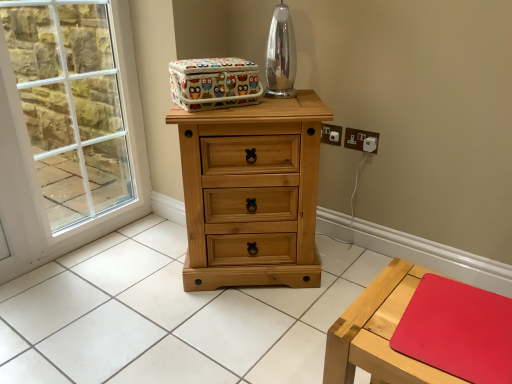
Question: Considering the relative sizes of white plastic electric outlet at upper right and colorful fabric storage box at upper center in the image provided, is white plastic electric outlet at upper right smaller than colorful fabric storage box at upper center?

Choices:
 (A) no
 (B) yes

Answer: (B)

Question: From a real-world perspective, does white plastic electric outlet at upper right sit lower than colorful fabric storage box at upper center?

Choices:
 (A) yes
 (B) no

Answer: (A)

Question: Is white plastic electric outlet at upper right closer to the viewer compared to colorful fabric storage box at upper center?

Choices:
 (A) yes
 (B) no

Answer: (B)

Question: Would you say white plastic electric outlet at upper right is a long distance from colorful fabric storage box at upper center?

Choices:
 (A) no
 (B) yes

Answer: (A)

Question: Is white plastic electric outlet at upper right at the left side of colorful fabric storage box at upper center?

Choices:
 (A) yes
 (B) no

Answer: (B)

Question: Is white plastic electric outlet at upper right bigger than colorful fabric storage box at upper center?

Choices:
 (A) yes
 (B) no

Answer: (B)

Question: Is colorful fabric storage box at upper center far from natural wood chest of drawers at center?

Choices:
 (A) no
 (B) yes

Answer: (A)

Question: Can natural wood chest of drawers at center be found inside colorful fabric storage box at upper center?

Choices:
 (A) yes
 (B) no

Answer: (B)

Question: Is colorful fabric storage box at upper center at the right side of natural wood chest of drawers at center?

Choices:
 (A) no
 (B) yes

Answer: (A)

Question: Can you confirm if colorful fabric storage box at upper center is positioned to the left of natural wood chest of drawers at center?

Choices:
 (A) no
 (B) yes

Answer: (B)

Question: Is colorful fabric storage box at upper center positioned with its back to natural wood chest of drawers at center?

Choices:
 (A) no
 (B) yes

Answer: (A)

Question: Does colorful fabric storage box at upper center turn towards natural wood chest of drawers at center?

Choices:
 (A) no
 (B) yes

Answer: (A)

Question: Is wooden table at lower right facing away from white plastic electric outlet at upper right?

Choices:
 (A) no
 (B) yes

Answer: (A)